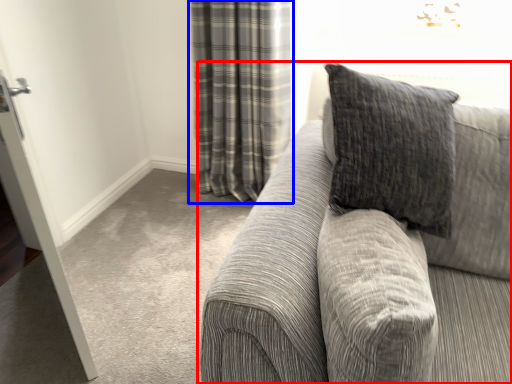
Question: Which object is closer to the camera taking this photo, studio couch (highlighted by a red box) or curtain (highlighted by a blue box)?

Choices:
 (A) studio couch
 (B) curtain

Answer: (A)